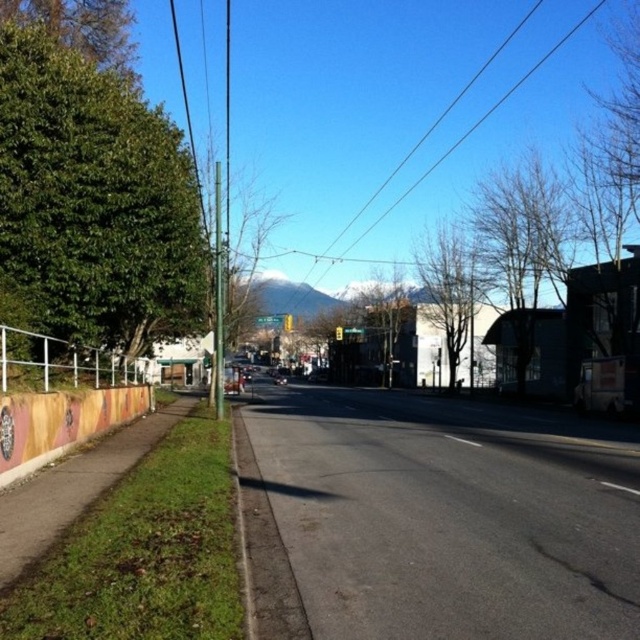
Does white metal fence at lower left appear on the right side of black wire at upper center?

No, white metal fence at lower left is not to the right of black wire at upper center.

Between point (90, 364) and point (422, 179), which one is positioned in front?

Point (90, 364) is in front.

Between point (70, 374) and point (604, 3), which one is positioned in front?

Point (70, 374)

This screenshot has width=640, height=640. Identify the location of white metal fence at lower left. 61,360.